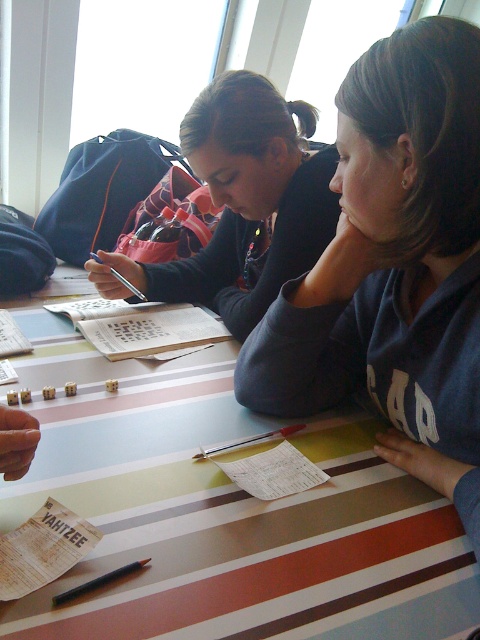
Image resolution: width=480 pixels, height=640 pixels. In order to click on black matte pen at lower left in this screenshot , I will do `click(98, 582)`.

Is point (58, 596) farther from camera compared to point (241, 440)?

That is False.

At what (x,y) coordinates should I click in order to perform the action: click on black matte pen at lower left. Please return your answer as a coordinate pair (x, y). Looking at the image, I should click on (98, 582).

Is dark gray sweatshirt at center closer to camera compared to black matte pen at lower left?

No, it is not.

Does dark gray sweatshirt at center have a greater height compared to black matte pen at lower left?

Yes, dark gray sweatshirt at center is taller than black matte pen at lower left.

Which is in front, point (457, 122) or point (76, 595)?

Point (76, 595) is more forward.

The height and width of the screenshot is (640, 480). Find the location of `dark gray sweatshirt at center`. dark gray sweatshirt at center is located at coordinates [395, 266].

Is point (386, 99) positioned before point (288, 246)?

Yes, it is in front of point (288, 246).

Who is more forward, (x=439, y=144) or (x=300, y=253)?

Point (x=439, y=144) is more forward.

Identify the location of dark gray sweatshirt at center. This screenshot has height=640, width=480. [395, 266].

The width and height of the screenshot is (480, 640). In order to click on dark gray sweatshirt at center in this screenshot , I will do `click(395, 266)`.